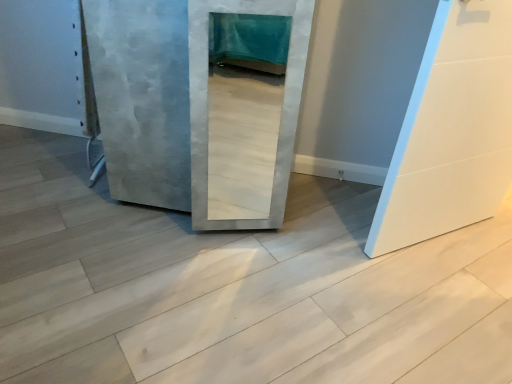
Question: Can you confirm if white matte door at right, the second door in the left-to-right sequence, is positioned to the left of concreteroughconcrete at center?

Choices:
 (A) no
 (B) yes

Answer: (A)

Question: Considering the relative positions of white matte door at right, placed as the 1th door when sorted from right to left, and concreteroughconcrete at center in the image provided, is white matte door at right, placed as the 1th door when sorted from right to left, behind concreteroughconcrete at center?

Choices:
 (A) no
 (B) yes

Answer: (B)

Question: From a real-world perspective, is white matte door at right, the second door in the left-to-right sequence, on concreteroughconcrete at center?

Choices:
 (A) no
 (B) yes

Answer: (B)

Question: From the image's perspective, is white matte door at right, placed as the 1th door when sorted from right to left, below concreteroughconcrete at center?

Choices:
 (A) yes
 (B) no

Answer: (B)

Question: Does white matte door at right, placed as the 1th door when sorted from right to left, turn towards concreteroughconcrete at center?

Choices:
 (A) yes
 (B) no

Answer: (B)

Question: Considering the relative sizes of white matte door at right, the second door in the left-to-right sequence, and concreteroughconcrete at center in the image provided, is white matte door at right, the second door in the left-to-right sequence, shorter than concreteroughconcrete at center?

Choices:
 (A) no
 (B) yes

Answer: (A)

Question: Considering the relative sizes of concreteroughconcrete at center and concrete textured door at center, which is counted as the first door, starting from the left, in the image provided, is concreteroughconcrete at center wider than concrete textured door at center, which is counted as the first door, starting from the left,?

Choices:
 (A) no
 (B) yes

Answer: (B)

Question: Would you say concrete textured door at center, which is the 2th door in right-to-left order, is part of concreteroughconcrete at center's contents?

Choices:
 (A) yes
 (B) no

Answer: (B)

Question: Could you tell me if concreteroughconcrete at center is turned towards concrete textured door at center, which is counted as the first door, starting from the left?

Choices:
 (A) yes
 (B) no

Answer: (B)

Question: Are concreteroughconcrete at center and concrete textured door at center, which is counted as the first door, starting from the left, making contact?

Choices:
 (A) yes
 (B) no

Answer: (B)

Question: Is concrete textured door at center, which is the 2th door in right-to-left order, at the back of concreteroughconcrete at center?

Choices:
 (A) no
 (B) yes

Answer: (A)

Question: Is concreteroughconcrete at center closer to camera compared to concrete textured door at center, which is the 2th door in right-to-left order?

Choices:
 (A) no
 (B) yes

Answer: (B)

Question: Considering the relative sizes of concreteroughconcrete at center and white matte door at right, placed as the 1th door when sorted from right to left, in the image provided, is concreteroughconcrete at center smaller than white matte door at right, placed as the 1th door when sorted from right to left,?

Choices:
 (A) no
 (B) yes

Answer: (A)